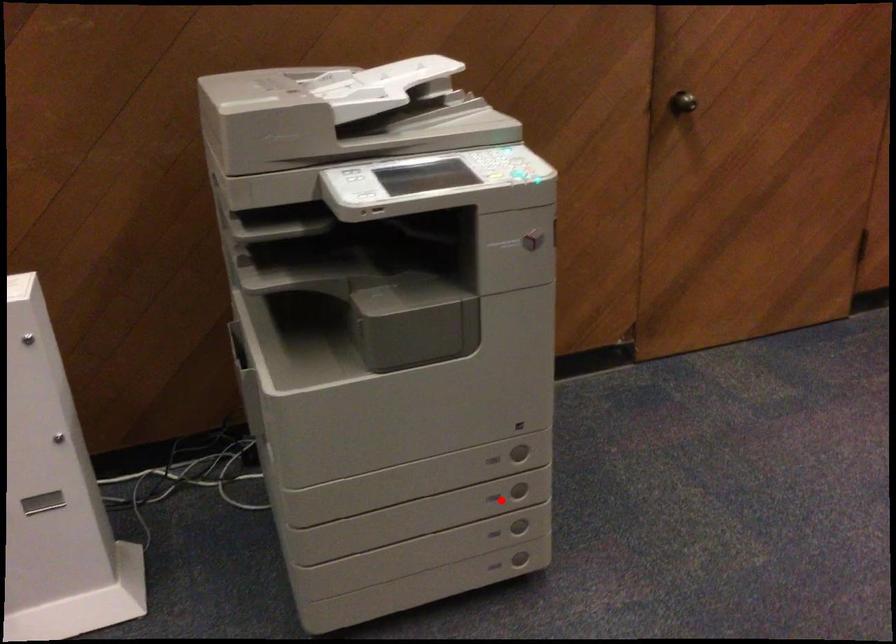
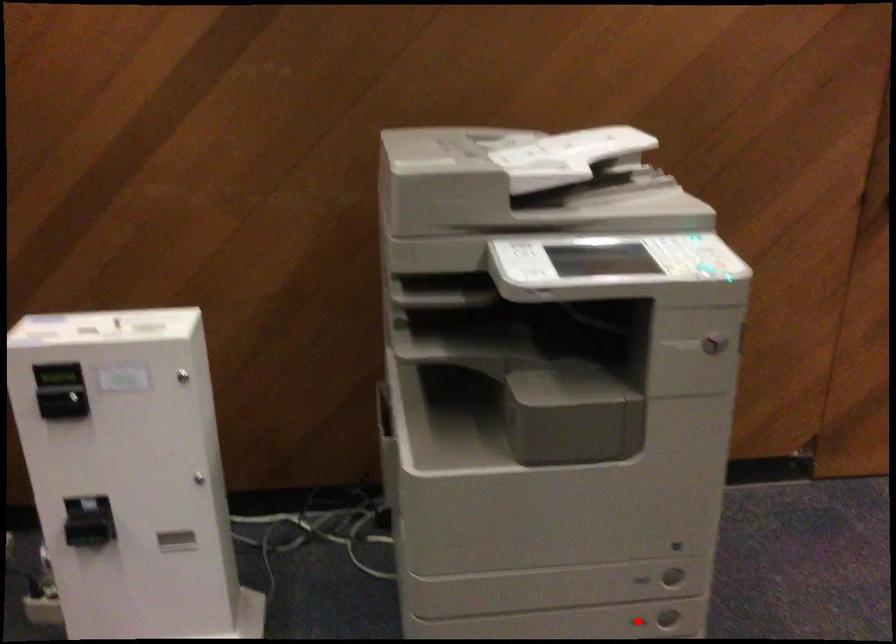
I am providing you with two images of the same scene from different viewpoints. A red point is marked on the first image and another point is marked on the second image. Is the red point in image1 aligned with the point shown in image2?

Yes